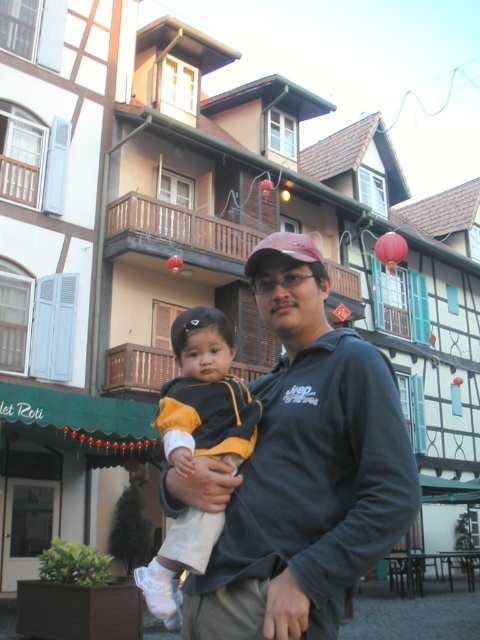
Question: Which object is positioned closest to the dark gray sweatshirt at center?

Choices:
 (A) yellow and black jacket at center
 (B) matte pink baseball cap at center

Answer: (A)

Question: Among these objects, which one is nearest to the camera?

Choices:
 (A) yellow and black jacket at center
 (B) matte pink baseball cap at center
 (C) dark gray sweatshirt at center

Answer: (A)

Question: Does yellow and black jacket at center lie in front of matte pink baseball cap at center?

Choices:
 (A) yes
 (B) no

Answer: (A)

Question: Estimate the real-world distances between objects in this image. Which object is farther from the dark gray sweatshirt at center?

Choices:
 (A) yellow and black jacket at center
 (B) matte pink baseball cap at center

Answer: (B)

Question: Can you confirm if dark gray sweatshirt at center is positioned above yellow and black jacket at center?

Choices:
 (A) yes
 (B) no

Answer: (B)

Question: In this image, where is dark gray sweatshirt at center located relative to matte pink baseball cap at center?

Choices:
 (A) below
 (B) above

Answer: (A)